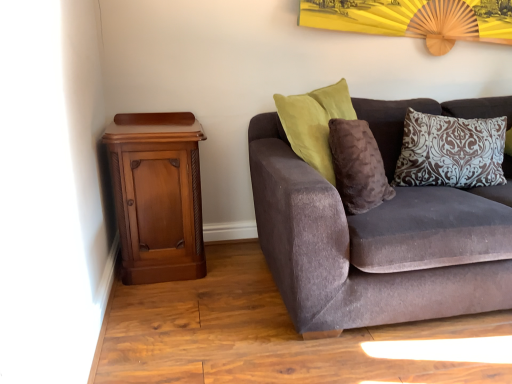
Question: Considering the relative sizes of polished wood nightstand at left and velvet brown couch at right in the image provided, is polished wood nightstand at left wider than velvet brown couch at right?

Choices:
 (A) yes
 (B) no

Answer: (B)

Question: Considering the relative positions of polished wood nightstand at left and velvet brown couch at right in the image provided, is polished wood nightstand at left to the right of velvet brown couch at right from the viewer's perspective?

Choices:
 (A) yes
 (B) no

Answer: (B)

Question: Is polished wood nightstand at left at the left side of velvet brown couch at right?

Choices:
 (A) no
 (B) yes

Answer: (B)

Question: Is the surface of polished wood nightstand at left in direct contact with velvet brown couch at right?

Choices:
 (A) yes
 (B) no

Answer: (B)

Question: Is polished wood nightstand at left positioned before velvet brown couch at right?

Choices:
 (A) no
 (B) yes

Answer: (A)

Question: From the image's perspective, is polished wood nightstand at left above or below brown damask pillow at upper right?

Choices:
 (A) above
 (B) below

Answer: (B)

Question: From a real-world perspective, relative to brown damask pillow at upper right, is polished wood nightstand at left vertically above or below?

Choices:
 (A) above
 (B) below

Answer: (B)

Question: Considering the positions of polished wood nightstand at left and brown damask pillow at upper right in the image, is polished wood nightstand at left taller or shorter than brown damask pillow at upper right?

Choices:
 (A) short
 (B) tall

Answer: (B)

Question: Is polished wood nightstand at left situated inside brown damask pillow at upper right or outside?

Choices:
 (A) inside
 (B) outside

Answer: (B)

Question: Considering the positions of point (154, 279) and point (332, 193), is point (154, 279) closer or farther from the camera than point (332, 193)?

Choices:
 (A) farther
 (B) closer

Answer: (A)

Question: Is polished wood nightstand at left inside or outside of velvet brown couch at right?

Choices:
 (A) outside
 (B) inside

Answer: (A)

Question: From the image's perspective, is polished wood nightstand at left above or below velvet brown couch at right?

Choices:
 (A) above
 (B) below

Answer: (B)

Question: In terms of height, does polished wood nightstand at left look taller or shorter compared to velvet brown couch at right?

Choices:
 (A) tall
 (B) short

Answer: (B)

Question: In terms of height, does brown damask pillow at upper right look taller or shorter compared to velvet brown couch at right?

Choices:
 (A) short
 (B) tall

Answer: (A)

Question: Based on their sizes in the image, would you say brown damask pillow at upper right is bigger or smaller than velvet brown couch at right?

Choices:
 (A) big
 (B) small

Answer: (B)